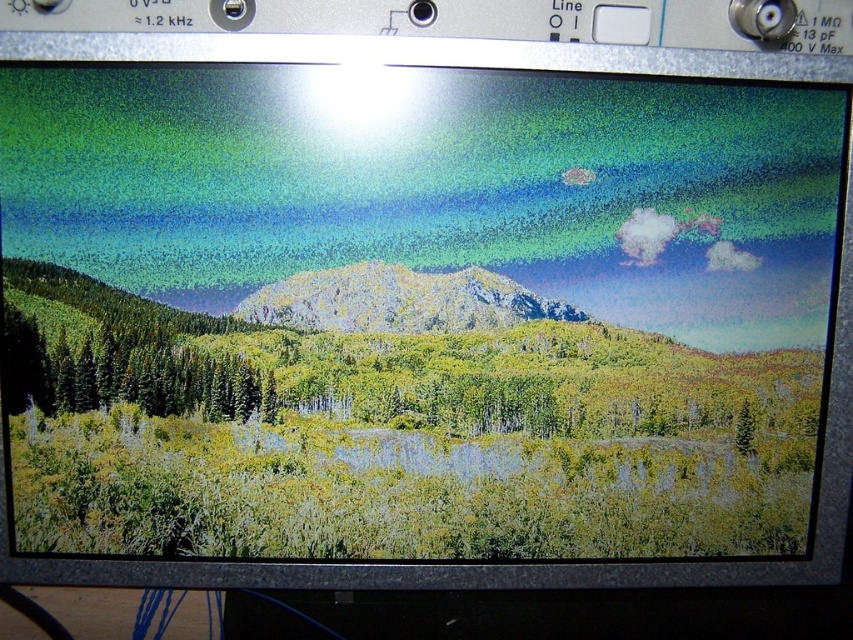
Is rocky mountain at center in front of green matte tree at lower right?

Yes, it is.

Is rocky mountain at center bigger than green matte tree at lower right?

Yes, rocky mountain at center is bigger than green matte tree at lower right.

Where is `rocky mountain at center`? The height and width of the screenshot is (640, 853). rocky mountain at center is located at coordinates (399, 300).

Is green matte tree at left bigger than rocky mountain at center?

Correct, green matte tree at left is larger in size than rocky mountain at center.

Between point (238, 369) and point (514, 314), which one is positioned in front?

Positioned in front is point (238, 369).

You are a GUI agent. You are given a task and a screenshot of the screen. Output one action in this format:
    pyautogui.click(x=<x>, y=<y>)
    Task: Click on the green matte tree at left
    
    Given the screenshot: What is the action you would take?
    (x=126, y=372)

Between green matte tree at left and green matte tree at lower right, which one has less height?

green matte tree at lower right

Which is behind, point (175, 412) or point (752, 422)?

The point (752, 422) is behind.

Identify the location of green matte tree at left. This screenshot has width=853, height=640. (126, 372).